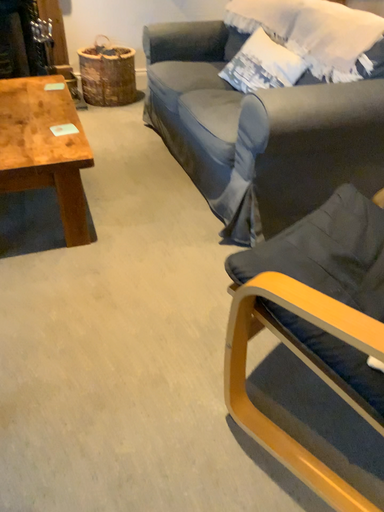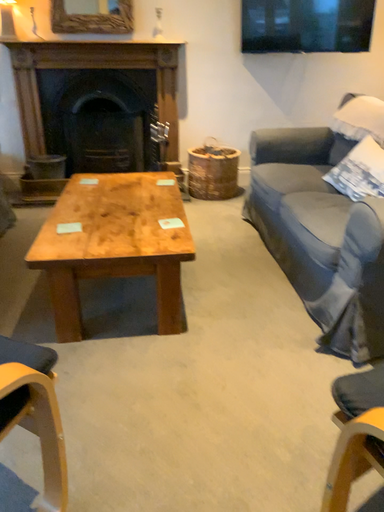
Question: Which way did the camera rotate in the video?

Choices:
 (A) rotated downward
 (B) rotated upward

Answer: (B)